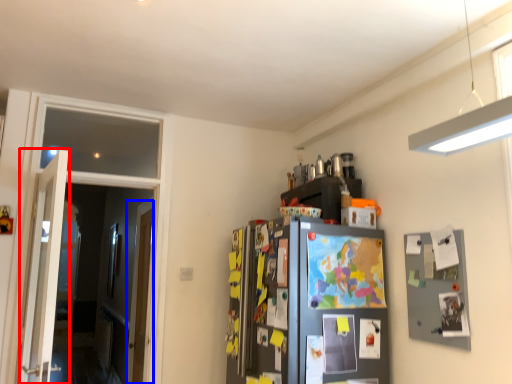
Question: Which object appears farthest to the camera in this image, door (highlighted by a red box) or door (highlighted by a blue box)?

Choices:
 (A) door
 (B) door

Answer: (B)